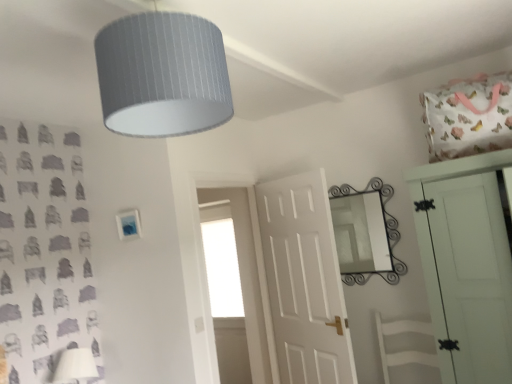
Question: Does point (361, 258) appear closer or farther from the camera than point (458, 228)?

Choices:
 (A) farther
 (B) closer

Answer: (A)

Question: Based on their positions, is black wrought iron mirror at upper right located to the left or right of white matte door at upper right, placed as the first door when sorted from front to back?

Choices:
 (A) left
 (B) right

Answer: (A)

Question: Estimate the real-world distances between objects in this image. Which object is farther from the white matte door at center, acting as the 1th door starting from the back?

Choices:
 (A) transparent glass window at center
 (B) white matte swivel chair at center
 (C) black wrought iron mirror at upper right
 (D) white fabric lampshade at lower left
 (E) textured gray lampshade at upper center

Answer: (E)

Question: Considering the real-world distances, which object is farthest from the black wrought iron mirror at upper right?

Choices:
 (A) white matte swivel chair at center
 (B) white matte door at center, acting as the 1th door starting from the back
 (C) white fabric lampshade at lower left
 (D) white matte door at upper right, positioned as the second door in back-to-front order
 (E) transparent glass window at center

Answer: (C)